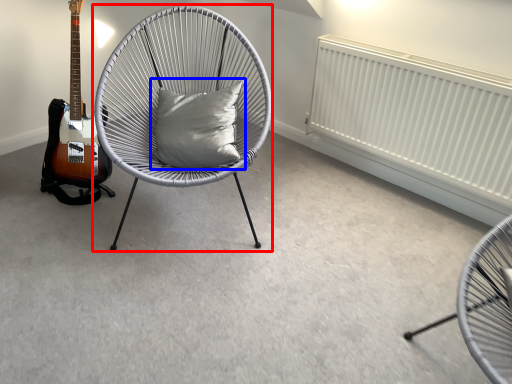
Question: Which object appears farthest to the camera in this image, chair (highlighted by a red box) or pillow (highlighted by a blue box)?

Choices:
 (A) chair
 (B) pillow

Answer: (B)